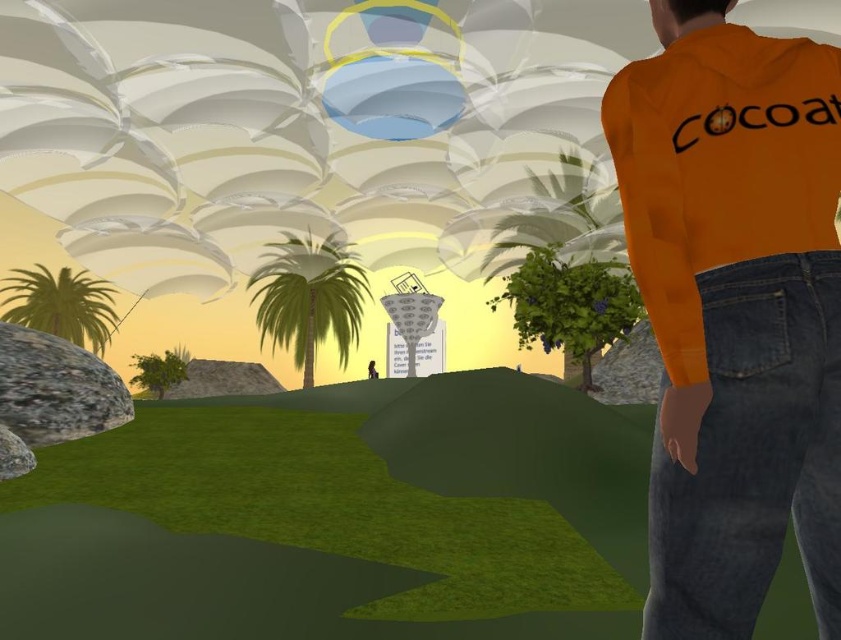
Consider the image. Measure the distance between point (24,580) and camera.

They are 2.21 meters apart.

The image size is (841, 640). What do you see at coordinates (337, 516) in the screenshot?
I see `green grass at lower left` at bounding box center [337, 516].

Is point (538, 602) farther from camera compared to point (311, 381)?

No, it is in front of (311, 381).

This screenshot has height=640, width=841. Identify the location of green grass at lower left. (337, 516).

Which of these two, denim at right or green leafy palm tree at center, stands taller?

Standing taller between the two is denim at right.

Is denim at right positioned at the back of green leafy palm tree at center?

No.

Image resolution: width=841 pixels, height=640 pixels. What do you see at coordinates (754, 454) in the screenshot?
I see `denim at right` at bounding box center [754, 454].

The width and height of the screenshot is (841, 640). Identify the location of denim at right. (754, 454).

In the scene shown: Can you confirm if green grass at lower left is smaller than green leafy palm tree at left?

Correct, green grass at lower left occupies less space than green leafy palm tree at left.

Between green grass at lower left and green leafy palm tree at left, which one is positioned higher?

green leafy palm tree at left is above.

Identify the location of green grass at lower left. The width and height of the screenshot is (841, 640). (337, 516).